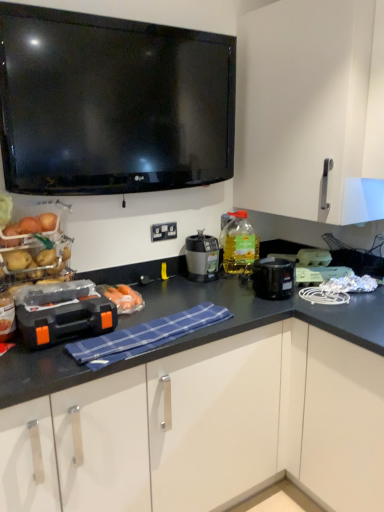
Question: In terms of width, does matte black blender at center look wider or thinner when compared to orange plastic toolbox at center, acting as the third appliance starting from the back?

Choices:
 (A) thin
 (B) wide

Answer: (A)

Question: Would you say matte black blender at center is to the left or to the right of orange plastic toolbox at center, positioned as the 1th appliance in left-to-right order, in the picture?

Choices:
 (A) right
 (B) left

Answer: (A)

Question: Which is nearer to the white matte cabinet at upper right?

Choices:
 (A) clear plastic egg carton at upper right, positioned as the first appliance in back-to-front order
 (B) white plastic electric outlet at center
 (C) orange plastic toolbox at center, marked as the third appliance in a right-to-left arrangement
 (D) green plastic toaster at center, positioned as the third appliance in left-to-right order
 (E) matte black blender at center

Answer: (A)

Question: Estimate the real-world distances between objects in this image. Which object is closer to the white plastic electric outlet at center?

Choices:
 (A) white matte cabinet at upper right
 (B) clear plastic egg carton at upper right, acting as the third appliance starting from the front
 (C) translucent plastic bottle at upper right
 (D) black plastic slow cooker at lower right
 (E) blue checkered cloth at center

Answer: (C)